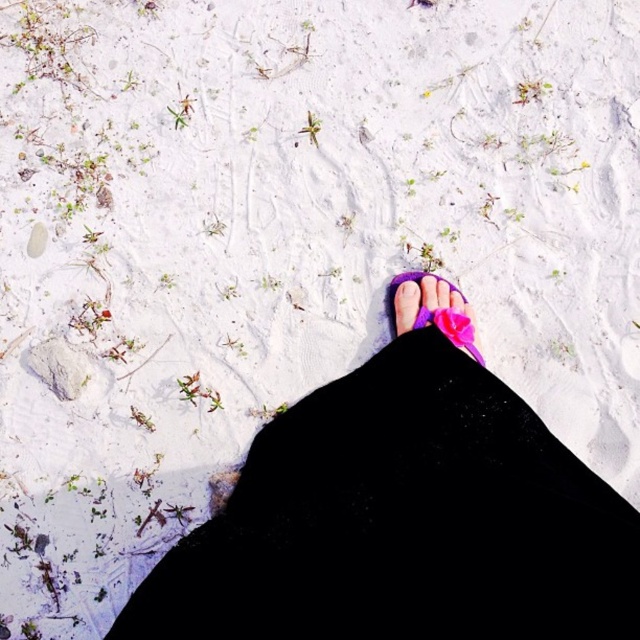
Question: From the image, what is the correct spatial relationship of purple fabric pants at center in relation to purple fabric sandal at center?

Choices:
 (A) right
 (B) left

Answer: (B)

Question: Can you confirm if purple fabric pants at center is wider than purple fabric sandal at center?

Choices:
 (A) no
 (B) yes

Answer: (B)

Question: Does purple fabric pants at center have a lesser width compared to purple fabric sandal at center?

Choices:
 (A) yes
 (B) no

Answer: (B)

Question: Which point is farther to the camera?

Choices:
 (A) [344, 604]
 (B) [406, 275]

Answer: (B)